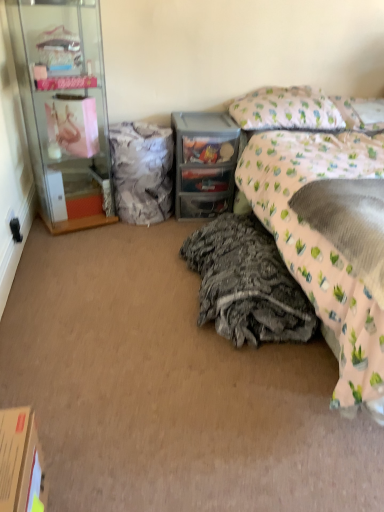
I want to click on free location to the left of textured gray blanket at lower center, which is the second material in back-to-front order, so click(x=117, y=293).